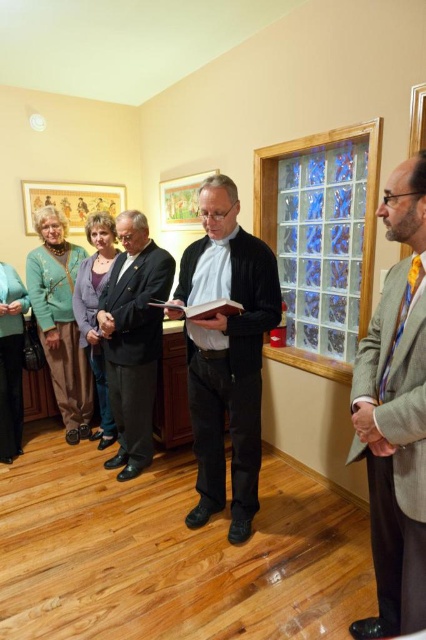
You are a photographer setting up for a group photo. You need to position the gray wool suit at right and the matte green sweater at left in such a way that both are visible in the frame. Based on their current positions, which one is lower in the image and might require adjustment to ensure it is fully visible?

The gray wool suit at right is below matte green sweater at left, so the gray wool suit at right is lower and might need adjustment to ensure it is fully visible.

You are standing at point (25, 300) and want to move to point (69, 344). Can you walk directly towards it without needing to go around any obstacles?

Point (69, 344) is behind point (25, 300), so you would need to go around the obstacle at point (25, 300) to reach it.